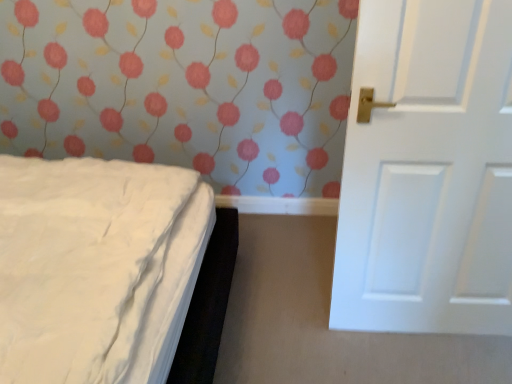
Question: Should I look upward or downward to see white soft bed at left?

Choices:
 (A) down
 (B) up

Answer: (A)

Question: Is white matte door at right positioned behind white soft bed at left?

Choices:
 (A) no
 (B) yes

Answer: (B)

Question: Is the position of white matte door at right less distant than that of white soft bed at left?

Choices:
 (A) yes
 (B) no

Answer: (B)

Question: Considering the relative sizes of white matte door at right and white soft bed at left in the image provided, is white matte door at right bigger than white soft bed at left?

Choices:
 (A) yes
 (B) no

Answer: (B)

Question: Would you consider white matte door at right to be distant from white soft bed at left?

Choices:
 (A) yes
 (B) no

Answer: (B)

Question: Does white matte door at right turn towards white soft bed at left?

Choices:
 (A) no
 (B) yes

Answer: (A)

Question: Is white matte door at right in contact with white soft bed at left?

Choices:
 (A) yes
 (B) no

Answer: (B)

Question: Is white soft bed at left taller than white matte door at right?

Choices:
 (A) no
 (B) yes

Answer: (B)

Question: Is the position of white soft bed at left less distant than that of white matte door at right?

Choices:
 (A) yes
 (B) no

Answer: (A)

Question: Is white soft bed at left oriented towards white matte door at right?

Choices:
 (A) yes
 (B) no

Answer: (A)

Question: Is white soft bed at left at the right side of white matte door at right?

Choices:
 (A) yes
 (B) no

Answer: (B)

Question: Would you consider white soft bed at left to be distant from white matte door at right?

Choices:
 (A) no
 (B) yes

Answer: (A)

Question: Considering the relative positions of white soft bed at left and white matte door at right in the image provided, is white soft bed at left to the left of white matte door at right from the viewer's perspective?

Choices:
 (A) yes
 (B) no

Answer: (A)

Question: In terms of width, does white matte door at right look wider or thinner when compared to white soft bed at left?

Choices:
 (A) wide
 (B) thin

Answer: (B)